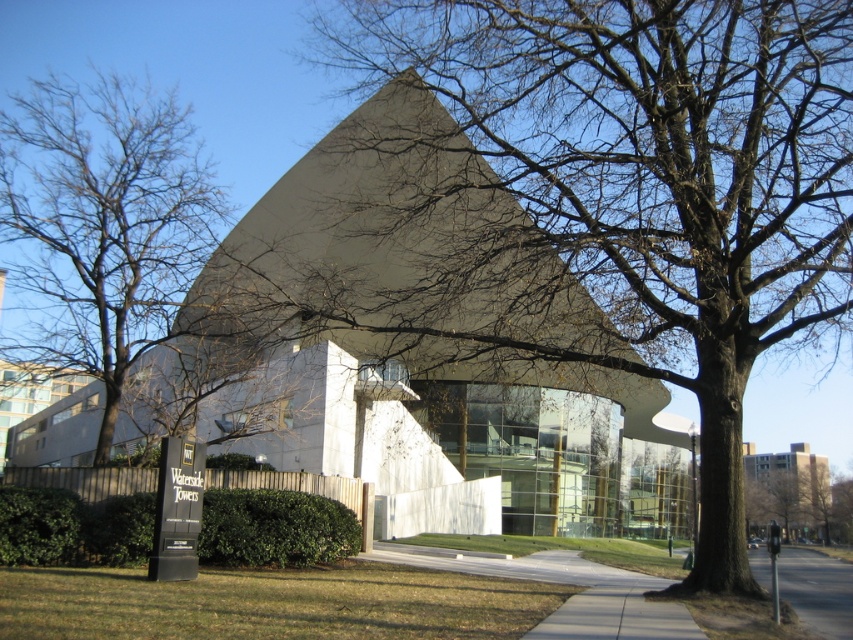
Can you confirm if bare branches at center is positioned to the right of gray asphalt at lower right?

No, bare branches at center is not to the right of gray asphalt at lower right.

Identify the location of bare branches at center. Image resolution: width=853 pixels, height=640 pixels. (103, 221).

Does bare branches at center have a greater width compared to brown textured tree at center?

Yes, bare branches at center is wider than brown textured tree at center.

This screenshot has width=853, height=640. Describe the element at coordinates (103, 221) in the screenshot. I see `bare branches at center` at that location.

The image size is (853, 640). What do you see at coordinates (103, 221) in the screenshot?
I see `bare branches at center` at bounding box center [103, 221].

At what (x,y) coordinates should I click in order to perform the action: click on bare branches at center. Please return your answer as a coordinate pair (x, y). This screenshot has width=853, height=640. Looking at the image, I should click on (103, 221).

Which of these two, brown textured tree at center or gray asphalt at lower right, stands taller?

Standing taller between the two is gray asphalt at lower right.

Who is positioned more to the left, brown textured tree at center or gray asphalt at lower right?

From the viewer's perspective, gray asphalt at lower right appears more on the left side.

Who is more forward, (840,518) or (780,592)?

Point (780,592) is more forward.

You are a GUI agent. You are given a task and a screenshot of the screen. Output one action in this format:
    pyautogui.click(x=<x>, y=<y>)
    Task: Click on the brown textured tree at center
    
    Given the screenshot: What is the action you would take?
    pyautogui.click(x=798, y=499)